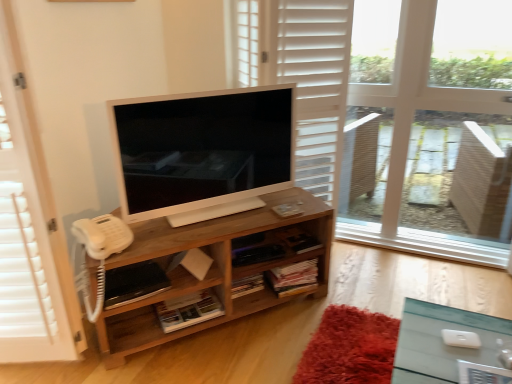
Question: Can satin white television at center be found inside woodenobject at center?

Choices:
 (A) yes
 (B) no

Answer: (B)

Question: Is woodenobject at center thinner than satin white television at center?

Choices:
 (A) no
 (B) yes

Answer: (A)

Question: Is the depth of woodenobject at center less than that of satin white television at center?

Choices:
 (A) yes
 (B) no

Answer: (B)

Question: From a real-world perspective, is woodenobject at center positioned over satin white television at center based on gravity?

Choices:
 (A) yes
 (B) no

Answer: (B)

Question: Considering the relative positions of woodenobject at center and satin white television at center in the image provided, is woodenobject at center to the right of satin white television at center from the viewer's perspective?

Choices:
 (A) yes
 (B) no

Answer: (B)

Question: Can you confirm if woodenobject at center is shorter than satin white television at center?

Choices:
 (A) yes
 (B) no

Answer: (A)

Question: Is satin white television at center positioned with its back to white wooden screen door at left?

Choices:
 (A) no
 (B) yes

Answer: (A)

Question: Does satin white television at center appear on the left side of white wooden screen door at left?

Choices:
 (A) no
 (B) yes

Answer: (A)

Question: Is satin white television at center smaller than white wooden screen door at left?

Choices:
 (A) yes
 (B) no

Answer: (A)

Question: Can you confirm if satin white television at center is thinner than white wooden screen door at left?

Choices:
 (A) yes
 (B) no

Answer: (A)

Question: Is satin white television at center wider than white wooden screen door at left?

Choices:
 (A) no
 (B) yes

Answer: (A)

Question: Can we say satin white television at center lies outside white wooden screen door at left?

Choices:
 (A) yes
 (B) no

Answer: (A)

Question: Is satin white television at center bigger than woodenobject at center?

Choices:
 (A) yes
 (B) no

Answer: (B)